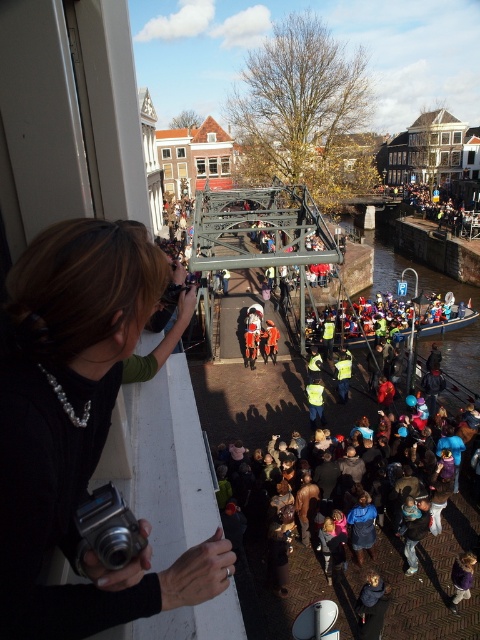
Consider the image. Is black fabric camera at left below silver metallic camera at lower left?

Yes, black fabric camera at left is below silver metallic camera at lower left.

Between point (15, 369) and point (79, 550), which one is positioned in front?

Point (15, 369) is more forward.

At what (x,y) coordinates should I click in order to perform the action: click on black fabric camera at left. Please return your answer as a coordinate pair (x, y). Looking at the image, I should click on (78, 432).